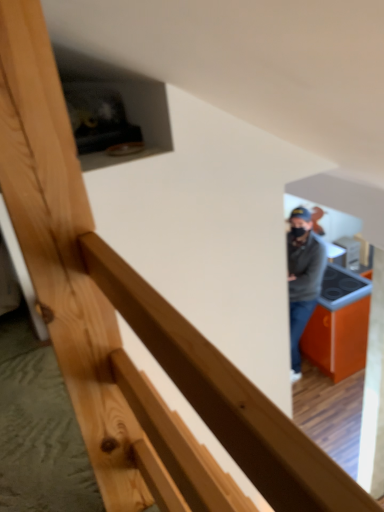
In order to face orange matte table at lower right, should I rotate leftwards or rightwards?

Turn right by 16.316 degrees to look at orange matte table at lower right.

Image resolution: width=384 pixels, height=512 pixels. What are the coordinates of `orange matte table at lower right` in the screenshot? It's located at (339, 324).

Describe the element at coordinates (339, 324) in the screenshot. The width and height of the screenshot is (384, 512). I see `orange matte table at lower right` at that location.

What are the coordinates of `orange matte table at lower right` in the screenshot? It's located at (339, 324).